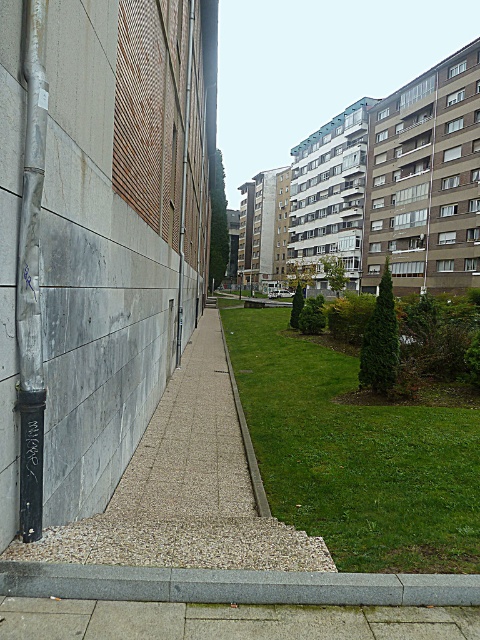
Question: Which object is farther from the camera taking this photo?

Choices:
 (A) gray concrete pavement at lower center
 (B) green grass at center
 (C) smooth concrete path at center
 (D) gray gravel at lower center

Answer: (B)

Question: Which point is closer to the camera taking this photo?

Choices:
 (A) (75, 545)
 (B) (311, 544)
 (C) (356, 605)
 (D) (424, 451)

Answer: (C)

Question: Can you confirm if smooth concrete path at center is positioned below gray concrete pavement at lower center?

Choices:
 (A) no
 (B) yes

Answer: (A)

Question: Which of the following is the farthest from the observer?

Choices:
 (A) gray concrete pavement at lower center
 (B) smooth concrete path at center
 (C) green grass at center
 (D) gray gravel at lower center

Answer: (C)

Question: Is green grass at center positioned at the back of gray gravel at lower center?

Choices:
 (A) no
 (B) yes

Answer: (B)

Question: Can you confirm if gray concrete pavement at lower center is positioned above gray gravel at lower center?

Choices:
 (A) no
 (B) yes

Answer: (A)